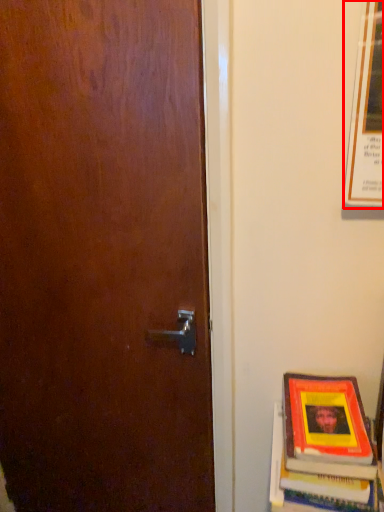
Question: From the image's perspective, considering the relative positions of poster (annotated by the red box) and book in the image provided, where is poster (annotated by the red box) located with respect to the staircase?

Choices:
 (A) above
 (B) below

Answer: (A)